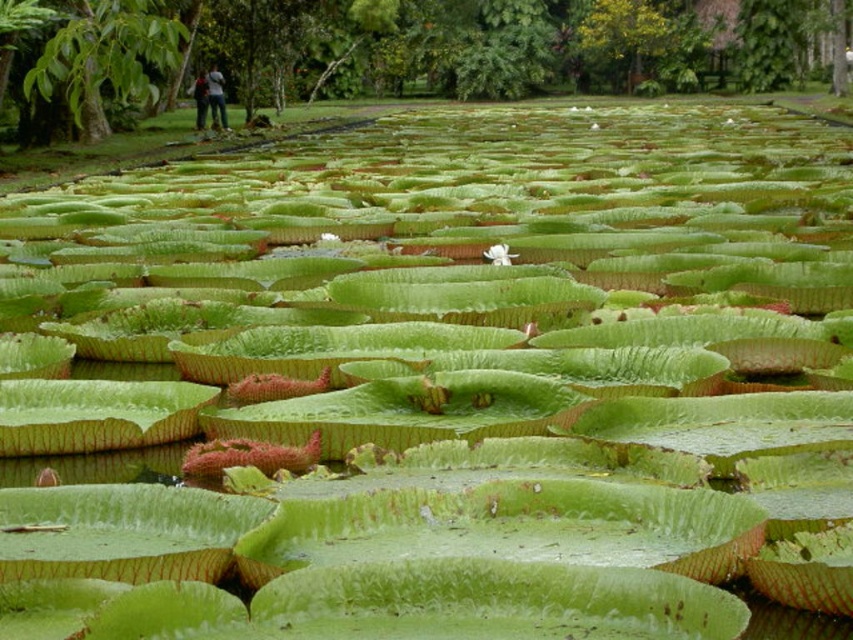
Is point (212, 96) farther from camera compared to point (502, 252)?

That is True.

Which is more to the left, denim jacket at upper left or white matte flower at center?

denim jacket at upper left

Is point (222, 104) closer to viewer compared to point (508, 257)?

No, (222, 104) is behind (508, 257).

Image resolution: width=853 pixels, height=640 pixels. In order to click on denim jacket at upper left in this screenshot , I will do `click(216, 97)`.

Between point (207, 92) and point (509, 259), which one is positioned in front?

Point (509, 259) is more forward.

Who is more forward, (x=204, y=88) or (x=508, y=250)?

Positioned in front is point (x=508, y=250).

This screenshot has height=640, width=853. I want to click on dark blue jeans at upper left, so click(200, 100).

Is point (215, 74) farther from viewer compared to point (200, 77)?

No, (215, 74) is closer to viewer.

Who is taller, denim jacket at upper left or dark blue jeans at upper left?

Standing taller between the two is dark blue jeans at upper left.

Is point (210, 77) closer to camera compared to point (199, 77)?

Yes, it is.

Locate an element on the screen. Image resolution: width=853 pixels, height=640 pixels. denim jacket at upper left is located at coordinates point(216,97).